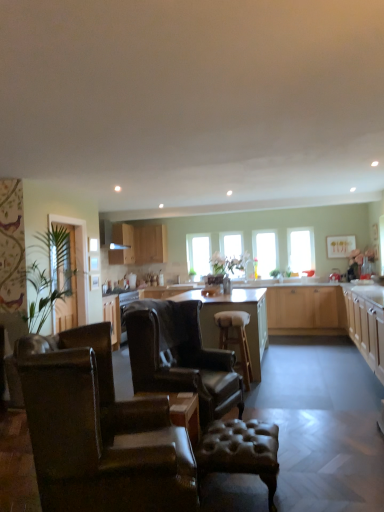
Question: Does leather wingback chair at center, arranged as the first chair when viewed from the back, have a greater width compared to clear glass door at left?

Choices:
 (A) no
 (B) yes

Answer: (B)

Question: Does leather wingback chair at center, which is counted as the second chair, starting from the front, have a smaller size compared to clear glass door at left?

Choices:
 (A) no
 (B) yes

Answer: (A)

Question: From a real-world perspective, does leather wingback chair at center, arranged as the first chair when viewed from the back, stand above clear glass door at left?

Choices:
 (A) no
 (B) yes

Answer: (A)

Question: Is clear glass door at left completely or partially inside leather wingback chair at center, which is counted as the second chair, starting from the front?

Choices:
 (A) no
 (B) yes

Answer: (A)

Question: From a real-world perspective, is leather wingback chair at center, arranged as the first chair when viewed from the back, positioned under clear glass door at left based on gravity?

Choices:
 (A) yes
 (B) no

Answer: (A)

Question: Looking at their shapes, would you say clear glass window at center, which is the 2th window from left to right, is wider or thinner than clear glass window at upper center, which is the first window from right to left?

Choices:
 (A) wide
 (B) thin

Answer: (A)

Question: Is point (223, 265) closer or farther from the camera than point (306, 242)?

Choices:
 (A) closer
 (B) farther

Answer: (B)

Question: Visually, is clear glass window at center, which is the 2th window from left to right, positioned to the left or to the right of clear glass window at upper center, which is the first window from right to left?

Choices:
 (A) left
 (B) right

Answer: (A)

Question: Is clear glass window at center, which is the third window in right-to-left order, spatially inside clear glass window at upper center, which appears as the fourth window when viewed from the left, or outside of it?

Choices:
 (A) inside
 (B) outside

Answer: (B)

Question: From a real-world perspective, is clear glass window at upper center, which is the first window from right to left, physically located above or below light brown wood countertop at center?

Choices:
 (A) above
 (B) below

Answer: (A)

Question: From the image's perspective, is clear glass window at upper center, which is the first window from right to left, positioned above or below light brown wood countertop at center?

Choices:
 (A) below
 (B) above

Answer: (B)

Question: From their relative heights in the image, would you say clear glass window at upper center, which appears as the fourth window when viewed from the left, is taller or shorter than light brown wood countertop at center?

Choices:
 (A) short
 (B) tall

Answer: (B)

Question: Is clear glass window at upper center, which is the first window from right to left, inside the boundaries of light brown wood countertop at center, or outside?

Choices:
 (A) inside
 (B) outside

Answer: (B)

Question: From a real-world perspective, is transparent glass window at center, the third window from the left, physically located above or below light wood cabinet at upper center, marked as the third cabinetry in a front-to-back arrangement?

Choices:
 (A) above
 (B) below

Answer: (B)

Question: Relative to light wood cabinet at upper center, which is the 1th cabinetry from left to right, is transparent glass window at center, the third window from the left, in front or behind?

Choices:
 (A) behind
 (B) front

Answer: (A)